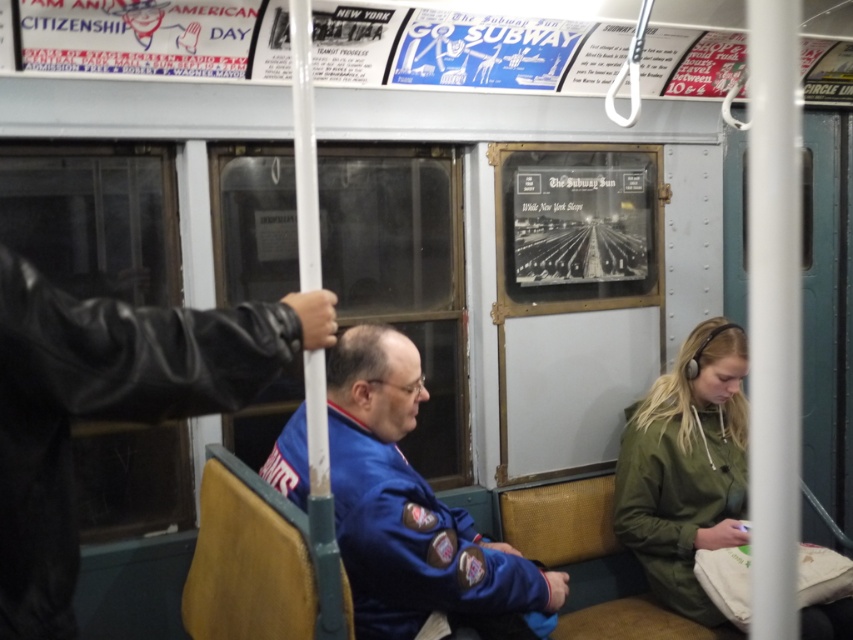
Who is more distant from viewer, (x=138, y=406) or (x=364, y=452)?

Point (x=364, y=452)

The width and height of the screenshot is (853, 640). Describe the element at coordinates (108, 406) in the screenshot. I see `leather jacket at left` at that location.

Locate an element on the screen. leather jacket at left is located at coordinates (108, 406).

The width and height of the screenshot is (853, 640). I want to click on leather jacket at left, so click(x=108, y=406).

Which is behind, point (67, 481) or point (735, 385)?

Positioned behind is point (735, 385).

Which is in front, point (44, 301) or point (618, 476)?

Point (44, 301)

At what (x,y) coordinates should I click in order to perform the action: click on leather jacket at left. Please return your answer as a coordinate pair (x, y). The width and height of the screenshot is (853, 640). Looking at the image, I should click on (108, 406).

Who is positioned more to the left, blue fabric jacket at center or green matte jacket at lower right?

Positioned to the left is blue fabric jacket at center.

The image size is (853, 640). Find the location of `blue fabric jacket at center`. blue fabric jacket at center is located at coordinates (408, 504).